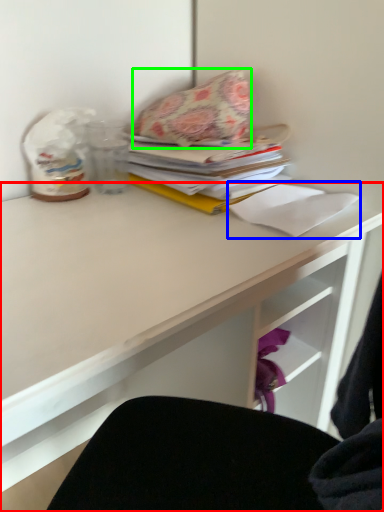
Question: Estimate the real-world distances between objects in this image. Which object is farther from desk (highlighted by a red box), paper (highlighted by a blue box) or throw pillow (highlighted by a green box)?

Choices:
 (A) paper
 (B) throw pillow

Answer: (B)